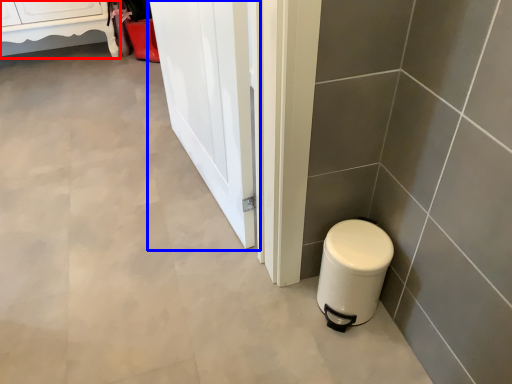
Question: Which object appears farthest to the camera in this image, furniture (highlighted by a red box) or screen door (highlighted by a blue box)?

Choices:
 (A) furniture
 (B) screen door

Answer: (A)